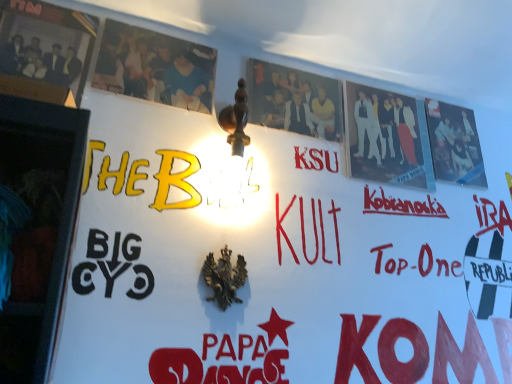
Question: Can you confirm if silhouette paper poster at upper right, which appears as the 2th poster when viewed from the right, is smaller than matte black photo frame at upper left, which ranks as the fifth poster in right-to-left order?

Choices:
 (A) no
 (B) yes

Answer: (B)

Question: Is silhouette paper poster at upper right, the 4th poster viewed from the left, to the right of matte black photo frame at upper left, which ranks as the fifth poster in right-to-left order, from the viewer's perspective?

Choices:
 (A) no
 (B) yes

Answer: (B)

Question: Is silhouette paper poster at upper right, the 4th poster viewed from the left, oriented towards matte black photo frame at upper left, which ranks as the fifth poster in right-to-left order?

Choices:
 (A) no
 (B) yes

Answer: (A)

Question: Considering the relative sizes of silhouette paper poster at upper right, the 4th poster viewed from the left, and matte black photo frame at upper left, which is counted as the 1th poster, starting from the left, in the image provided, is silhouette paper poster at upper right, the 4th poster viewed from the left, wider than matte black photo frame at upper left, which is counted as the 1th poster, starting from the left,?

Choices:
 (A) yes
 (B) no

Answer: (B)

Question: Is silhouette paper poster at upper right, the 4th poster viewed from the left, to the left of matte black photo frame at upper left, which is counted as the 1th poster, starting from the left, from the viewer's perspective?

Choices:
 (A) no
 (B) yes

Answer: (A)

Question: Is silhouette paper poster at upper right, which appears as the 2th poster when viewed from the right, spatially inside matte paper poster at center, which ranks as the third poster in right-to-left order, or outside of it?

Choices:
 (A) outside
 (B) inside

Answer: (A)

Question: Is silhouette paper poster at upper right, which appears as the 2th poster when viewed from the right, wider or thinner than matte paper poster at center, which ranks as the third poster in right-to-left order?

Choices:
 (A) wide
 (B) thin

Answer: (A)

Question: From a real-world perspective, relative to matte paper poster at center, which ranks as the third poster in left-to-right order, is silhouette paper poster at upper right, the 4th poster viewed from the left, vertically above or below?

Choices:
 (A) below
 (B) above

Answer: (A)

Question: Looking at the image, does silhouette paper poster at upper right, the 4th poster viewed from the left, seem bigger or smaller compared to matte paper poster at center, which ranks as the third poster in left-to-right order?

Choices:
 (A) small
 (B) big

Answer: (B)

Question: From a real-world perspective, relative to matte paper poster at upper left, the fourth poster viewed from the right, is matte black poster at upper right, positioned as the first poster in right-to-left order, vertically above or below?

Choices:
 (A) above
 (B) below

Answer: (B)

Question: In terms of width, does matte black poster at upper right, which ranks as the fifth poster in left-to-right order, look wider or thinner when compared to matte paper poster at upper left, the fourth poster viewed from the right?

Choices:
 (A) thin
 (B) wide

Answer: (B)

Question: Does point (457, 147) appear closer or farther from the camera than point (128, 62)?

Choices:
 (A) closer
 (B) farther

Answer: (B)

Question: In the image, is matte black poster at upper right, positioned as the first poster in right-to-left order, positioned in front of or behind matte paper poster at upper left, which is counted as the second poster, starting from the left?

Choices:
 (A) front
 (B) behind

Answer: (B)

Question: Would you say matte black photo frame at upper left, which ranks as the fifth poster in right-to-left order, is inside or outside matte paper poster at center, which ranks as the third poster in left-to-right order?

Choices:
 (A) inside
 (B) outside

Answer: (B)

Question: In the image, is matte black photo frame at upper left, which ranks as the fifth poster in right-to-left order, positioned in front of or behind matte paper poster at center, which ranks as the third poster in left-to-right order?

Choices:
 (A) front
 (B) behind

Answer: (A)